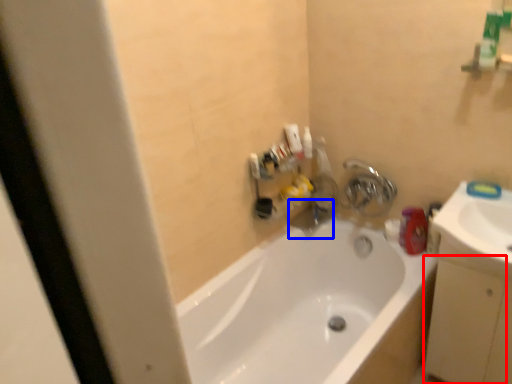
Question: Which object is closer to the camera taking this photo, drawer (highlighted by a red box) or plumbing fixture (highlighted by a blue box)?

Choices:
 (A) drawer
 (B) plumbing fixture

Answer: (A)